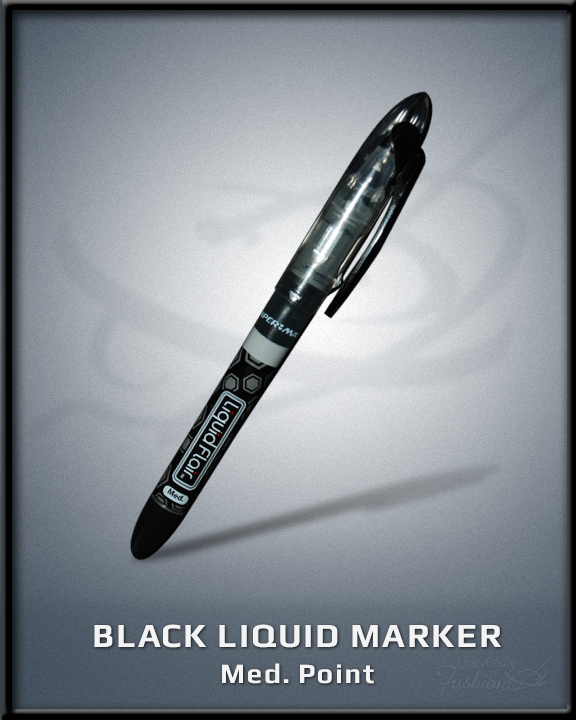
This screenshot has height=720, width=576. Identify the location of pen. (291, 314).